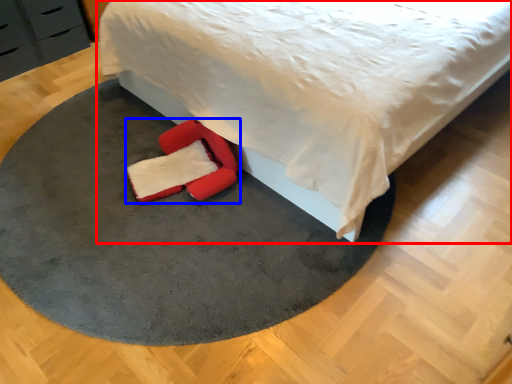
Question: Which object appears closest to the camera in this image, bed (highlighted by a red box) or footwear (highlighted by a blue box)?

Choices:
 (A) bed
 (B) footwear

Answer: (A)